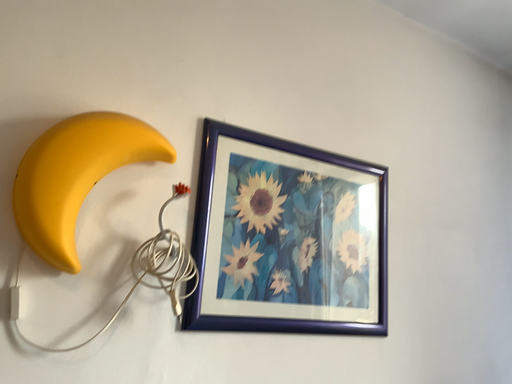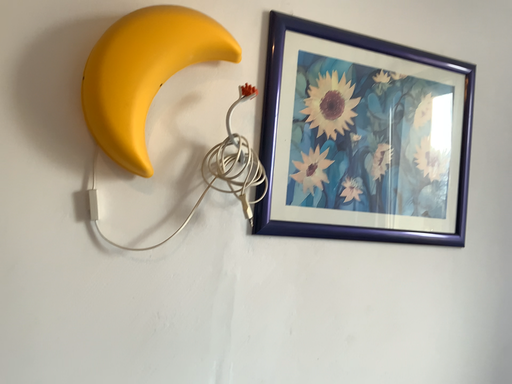
Question: How did the camera likely rotate when shooting the video?

Choices:
 (A) rotated right
 (B) rotated left

Answer: (B)